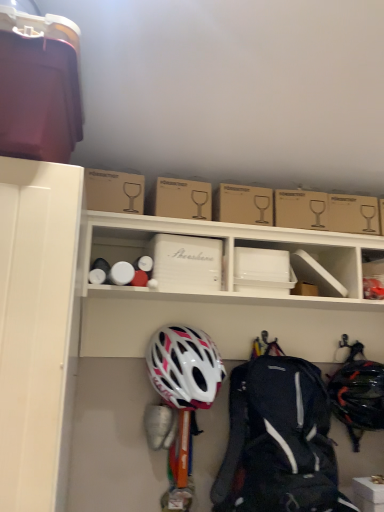
Question: From the image's perspective, is brown cardboard box at upper center, the 1th cardboard box when ordered from left to right, located beneath white matte helmet at center, marked as the first helmet in a left-to-right arrangement?

Choices:
 (A) no
 (B) yes

Answer: (A)

Question: Is brown cardboard box at upper center, the 1th cardboard box when ordered from left to right, not within white matte helmet at center, marked as the first helmet in a left-to-right arrangement?

Choices:
 (A) yes
 (B) no

Answer: (A)

Question: Does brown cardboard box at upper center, the 1th cardboard box when ordered from left to right, have a greater height compared to white matte helmet at center, the 2th helmet when ordered from right to left?

Choices:
 (A) no
 (B) yes

Answer: (A)

Question: Does brown cardboard box at upper center, placed as the fourth cardboard box when sorted from right to left, lie behind white matte helmet at center, the 2th helmet when ordered from right to left?

Choices:
 (A) yes
 (B) no

Answer: (B)

Question: From the image's perspective, does brown cardboard box at upper center, placed as the fourth cardboard box when sorted from right to left, appear higher than white matte helmet at center, the 2th helmet when ordered from right to left?

Choices:
 (A) yes
 (B) no

Answer: (A)

Question: In the image, is white matte storage box at center positioned in front of or behind white plastic storage box at upper right, positioned as the second storage box in top-to-bottom order?

Choices:
 (A) behind
 (B) front

Answer: (B)

Question: In terms of width, does white matte storage box at center look wider or thinner when compared to white plastic storage box at upper right, positioned as the second storage box in top-to-bottom order?

Choices:
 (A) thin
 (B) wide

Answer: (B)

Question: Choose the correct answer: Is white matte storage box at center inside white plastic storage box at upper right, the 1th storage box positioned from the right, or outside it?

Choices:
 (A) outside
 (B) inside

Answer: (A)

Question: From the image's perspective, relative to white plastic storage box at upper right, positioned as the third storage box in left-to-right order, is white matte storage box at center above or below?

Choices:
 (A) above
 (B) below

Answer: (A)

Question: From a real-world perspective, is brown cardboard box at upper center, arranged as the fourth cardboard box when viewed from the left, positioned above or below white plastic storage box at upper right, positioned as the second storage box in top-to-bottom order?

Choices:
 (A) above
 (B) below

Answer: (A)

Question: In the image, is brown cardboard box at upper center, acting as the first cardboard box starting from the right, on the left side or the right side of white plastic storage box at upper right, the 1th storage box positioned from the right?

Choices:
 (A) right
 (B) left

Answer: (B)

Question: In terms of size, does brown cardboard box at upper center, acting as the first cardboard box starting from the right, appear bigger or smaller than white plastic storage box at upper right, the second storage box ordered from the bottom?

Choices:
 (A) big
 (B) small

Answer: (A)

Question: Relative to white plastic storage box at upper right, positioned as the third storage box in left-to-right order, is brown cardboard box at upper center, arranged as the fourth cardboard box when viewed from the left, in front or behind?

Choices:
 (A) front
 (B) behind

Answer: (A)

Question: Is white plastic storage box at upper right, the second storage box ordered from the bottom, in front of or behind brown cardboard box at upper center, the 2th cardboard box viewed from the right, in the image?

Choices:
 (A) front
 (B) behind

Answer: (B)

Question: Does point (370, 290) appear closer or farther from the camera than point (160, 202)?

Choices:
 (A) farther
 (B) closer

Answer: (A)